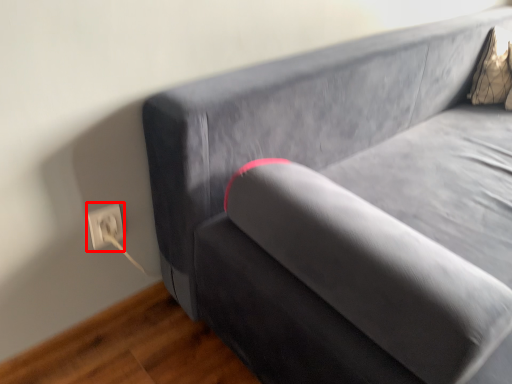
Question: From the image's perspective, where is electric outlet (annotated by the red box) located relative to pillow?

Choices:
 (A) above
 (B) below

Answer: (B)